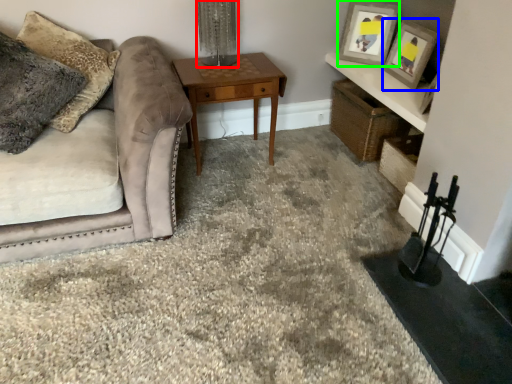
Question: Based on their relative distances, which object is farther from table lamp (highlighted by a red box)? Choose from picture frame (highlighted by a blue box) and picture frame (highlighted by a green box).

Choices:
 (A) picture frame
 (B) picture frame

Answer: (A)